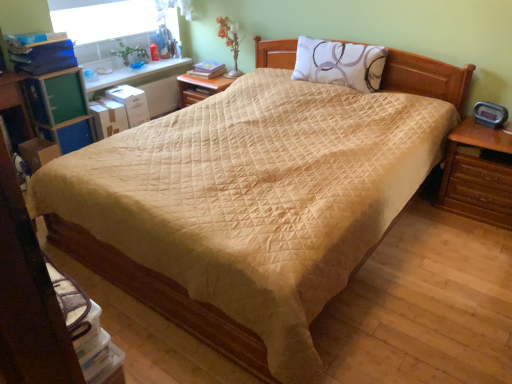
Question: Is white printed pillow at upper center spatially inside matte yellow book at center, or outside of it?

Choices:
 (A) inside
 (B) outside

Answer: (B)

Question: Is white printed pillow at upper center in front of or behind matte yellow book at center in the image?

Choices:
 (A) behind
 (B) front

Answer: (B)

Question: Based on their relative distances, which object is farther from the white printed pillow at upper center?

Choices:
 (A) matte yellow book at center
 (B) white plastic window screen at upper left

Answer: (B)

Question: Which is nearer to the white plastic window screen at upper left?

Choices:
 (A) matte yellow book at center
 (B) white printed pillow at upper center

Answer: (A)